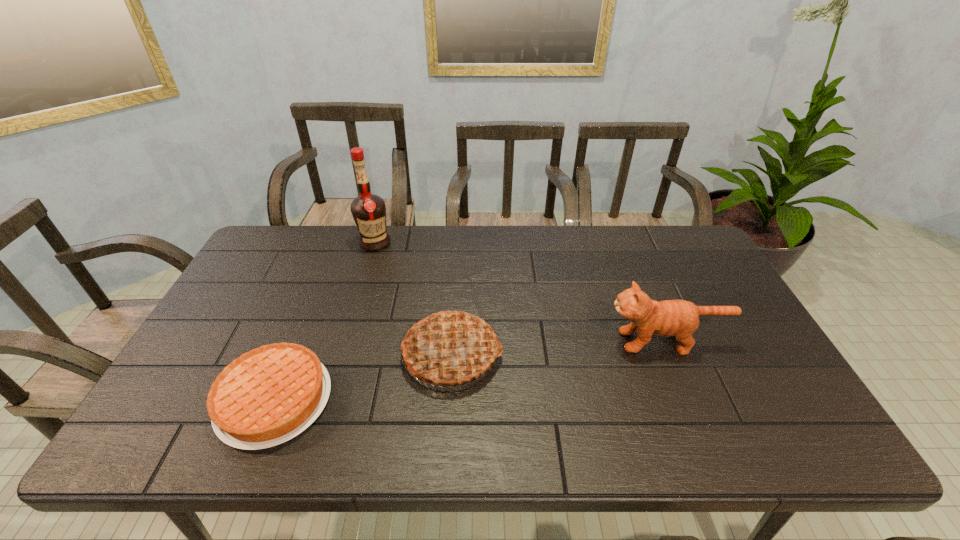
I want to click on free space at the right edge, so click(722, 359).

I want to click on free location at the far left corner of the desktop, so click(285, 260).

In the image, there is a desktop. At what (x,y) coordinates should I click in order to perform the action: click on vacant region at the near left corner. Please return your answer as a coordinate pair (x, y). Looking at the image, I should click on (192, 444).

Find the location of `vacant space at the far right corner of the desktop`. vacant space at the far right corner of the desktop is located at coordinates (666, 242).

The width and height of the screenshot is (960, 540). Identify the location of blank area at the near right corner. (805, 448).

Locate an element on the screen. The width and height of the screenshot is (960, 540). empty space that is in between the farthest object and the shortest object is located at coordinates (324, 322).

Where is `free space between the second object from right to left and the rightmost object`? The height and width of the screenshot is (540, 960). free space between the second object from right to left and the rightmost object is located at coordinates (559, 348).

Image resolution: width=960 pixels, height=540 pixels. Identify the location of vacant area that lies between the taller pie and the rightmost object. click(x=559, y=348).

This screenshot has width=960, height=540. In order to click on free space that is in between the cat and the taller pie in this screenshot , I will do `click(559, 348)`.

Where is `vacant region between the tallest object and the right pie`? vacant region between the tallest object and the right pie is located at coordinates (414, 299).